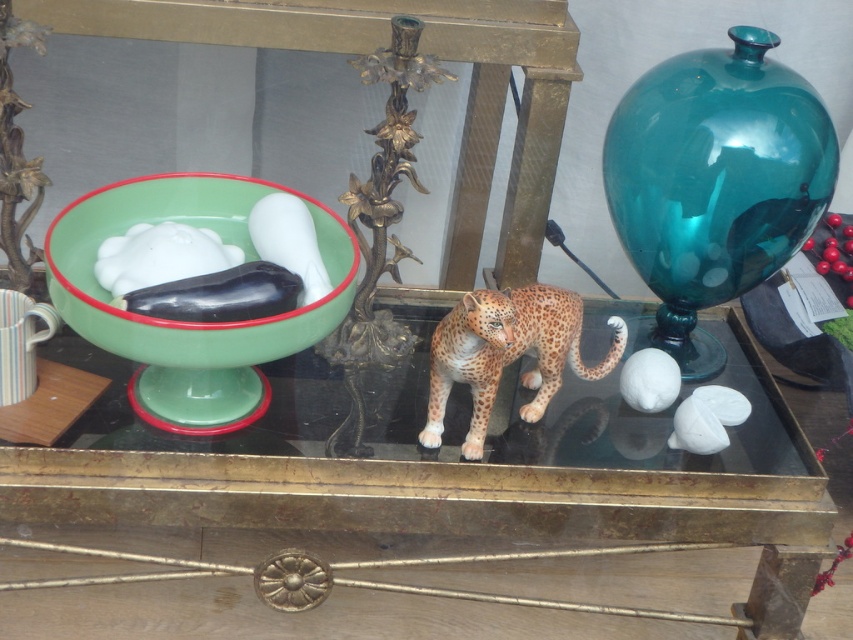
Is glossy glass table at center above green glass bowl at left?

No, glossy glass table at center is not above green glass bowl at left.

Does glossy glass table at center come in front of green glass bowl at left?

No, it is not.

Where is `glossy glass table at center`? This screenshot has width=853, height=640. glossy glass table at center is located at coordinates (421, 470).

You are a GUI agent. You are given a task and a screenshot of the screen. Output one action in this format:
    pyautogui.click(x=<x>, y=<y>)
    Task: Click on the glossy glass table at center
    Image resolution: width=853 pixels, height=640 pixels.
    Given the screenshot: What is the action you would take?
    (x=421, y=470)

Does glossy glass table at center have a smaller size compared to spotted fur cheetah at center?

No, glossy glass table at center is not smaller than spotted fur cheetah at center.

Can you confirm if glossy glass table at center is shorter than spotted fur cheetah at center?

No, glossy glass table at center is not shorter than spotted fur cheetah at center.

I want to click on glossy glass table at center, so tap(421, 470).

Where is `glossy glass table at center`? The height and width of the screenshot is (640, 853). glossy glass table at center is located at coordinates (421, 470).

Is point (161, 426) less distant than point (515, 301)?

Yes, point (161, 426) is closer to viewer.

Is green glass bowl at left below spotted fur cheetah at center?

Actually, green glass bowl at left is above spotted fur cheetah at center.

Does point (202, 221) come farther from viewer compared to point (488, 396)?

Yes, it is.

Locate an element on the screen. The width and height of the screenshot is (853, 640). green glass bowl at left is located at coordinates (190, 321).